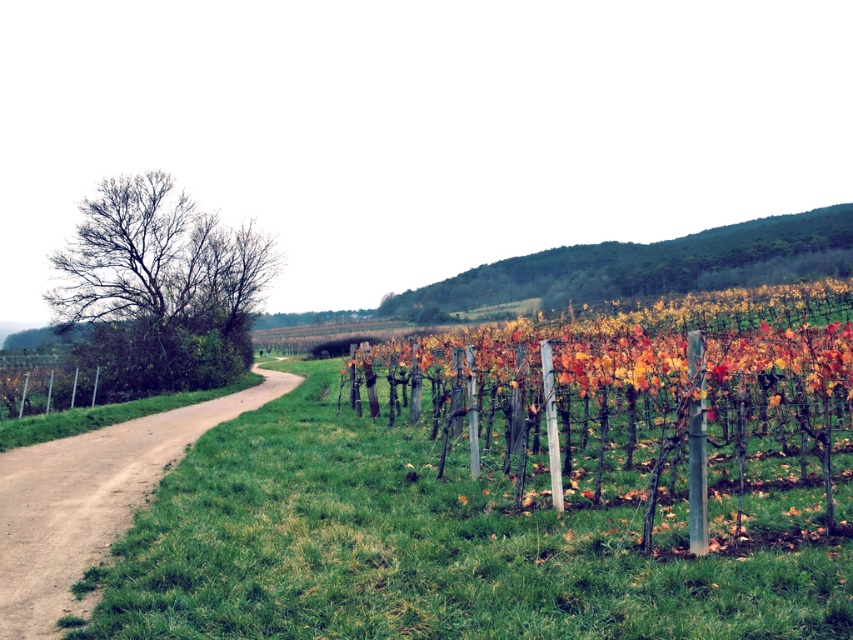
Question: Considering the relative positions of bare branches at left and brown dirt track at left in the image provided, where is bare branches at left located with respect to brown dirt track at left?

Choices:
 (A) right
 (B) left

Answer: (B)

Question: Which point is closer to the camera?

Choices:
 (A) (703, 244)
 (B) (485, 376)
 (C) (245, 362)

Answer: (B)

Question: Among these points, which one is nearest to the camera?

Choices:
 (A) (120, 316)
 (B) (421, 314)

Answer: (A)

Question: Which object is farther from the camera taking this photo?

Choices:
 (A) autumn leaves at center
 (B) brown dirt track at left

Answer: (A)

Question: Does bare branches at left come behind green leafy hillside at upper center?

Choices:
 (A) yes
 (B) no

Answer: (B)

Question: Does brown dirt track at left have a lesser width compared to green leafy hillside at upper center?

Choices:
 (A) yes
 (B) no

Answer: (A)